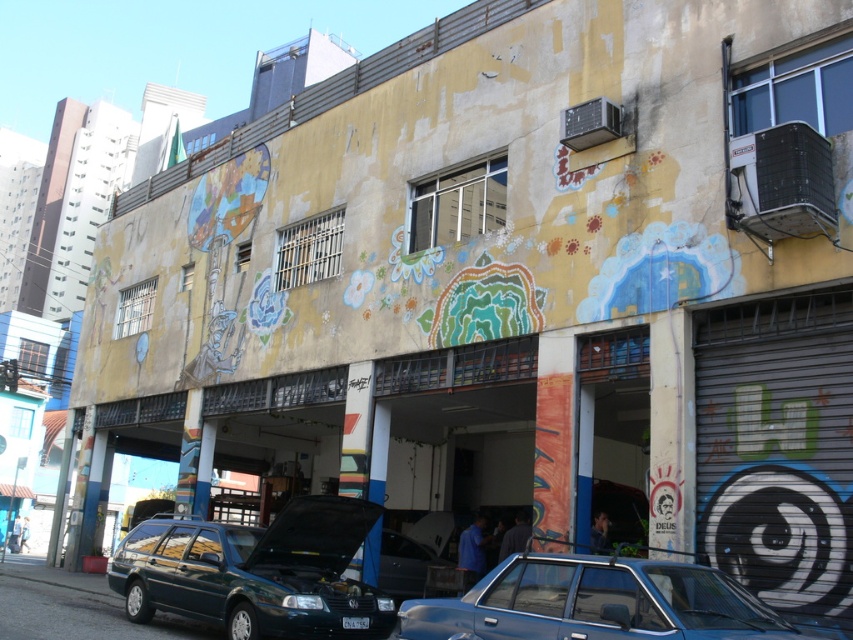
You are a delivery person trying to park your van next to the green matte station wagon at lower center and the white plastic license plate at center. Since you need to know the size of the vehicles to fit your van properly, can you tell me which one is bigger?

The green matte station wagon at lower center is larger in size than the white plastic license plate at center, so the station wagon is bigger.

You are a delivery person trying to park your van between the green matte station wagon at lower center and the metallic blue sedan at lower center. Based on the scene, can your van, which is 2.2 meters wide, fit in the space between them?

The green matte station wagon at lower center is narrower than the metallic blue sedan at lower center. However, the exact width of the space between them isn